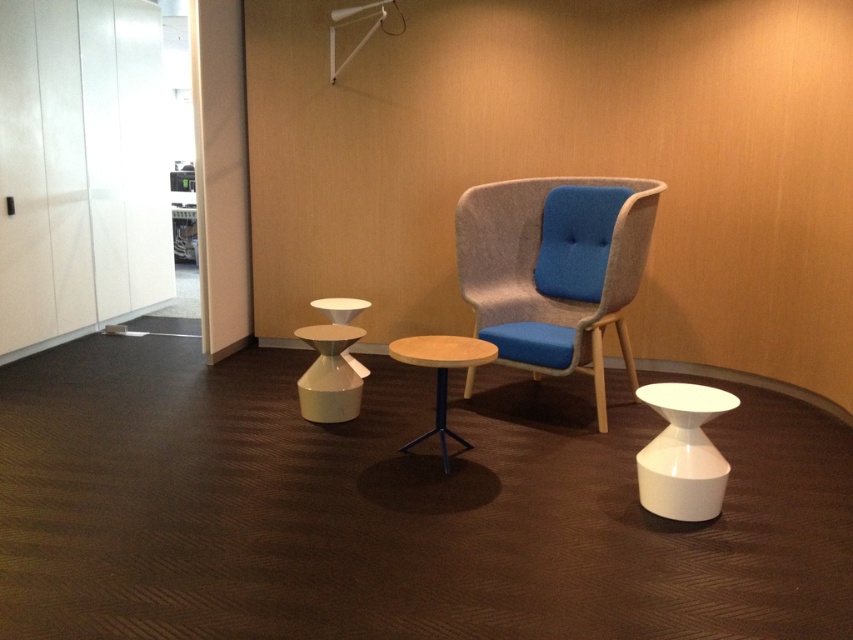
You are standing in the center of the room and want to place a new plant pot exactly where the white glossy side table at center is currently located. What are the coordinates where you should place the plant pot?

The coordinates for placing the plant pot should be at point (x=329, y=374), which is the current position of the white glossy side table at center.